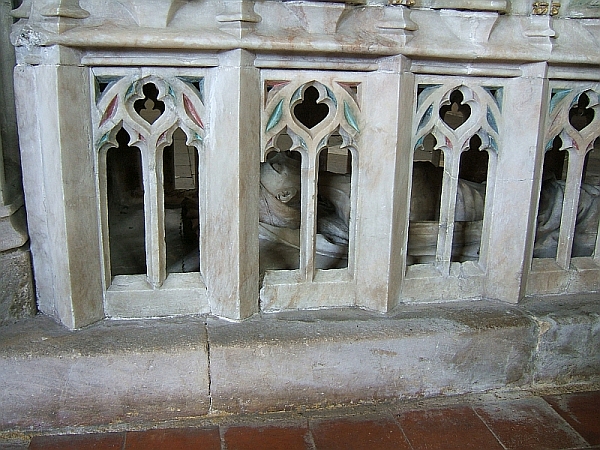
Where is `banister`? banister is located at coordinates (533, 152), (393, 162), (223, 167), (53, 157).